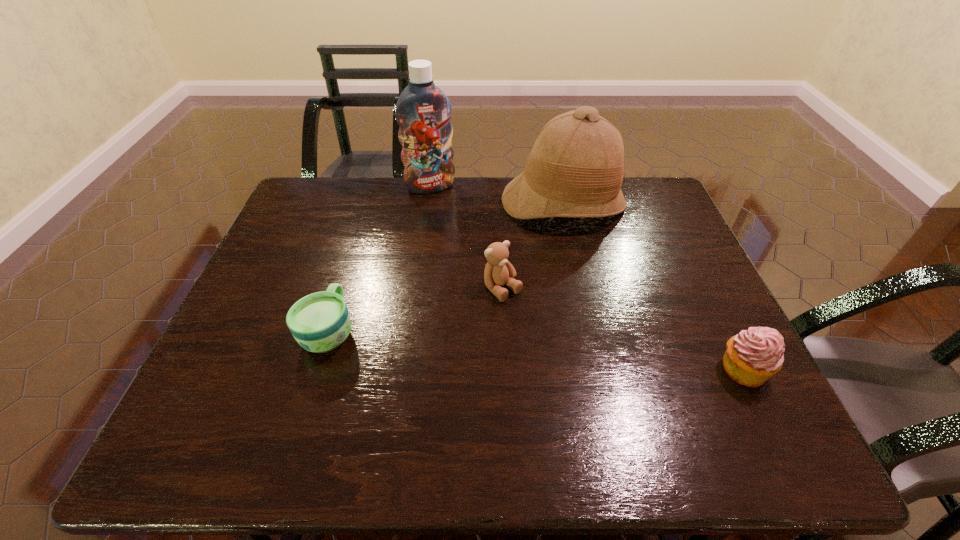
Where is `vacant space situated 0.100m on the front-facing side of the teddy bear`? The width and height of the screenshot is (960, 540). vacant space situated 0.100m on the front-facing side of the teddy bear is located at coordinates (540, 327).

This screenshot has height=540, width=960. I want to click on vacant space positioned on the front-facing side of the teddy bear, so click(x=563, y=350).

The image size is (960, 540). In order to click on blank area located on the front-facing side of the hat in this screenshot , I will do `click(580, 328)`.

The height and width of the screenshot is (540, 960). What are the coordinates of `vacant region located 0.310m on the front-facing side of the hat` in the screenshot? It's located at (578, 315).

At what (x,y) coordinates should I click in order to perform the action: click on vacant space located 0.310m on the front-facing side of the hat. Please return your answer as a coordinate pair (x, y). This screenshot has width=960, height=540. Looking at the image, I should click on (578, 315).

This screenshot has width=960, height=540. I want to click on vacant space located on the front label of the tallest object, so click(468, 262).

Where is `vacant space located 0.250m on the front label of the tallest object`? This screenshot has width=960, height=540. vacant space located 0.250m on the front label of the tallest object is located at coordinates (459, 242).

Find the location of a particular element. This screenshot has width=960, height=540. free space located 0.290m on the front label of the tallest object is located at coordinates (463, 251).

The image size is (960, 540). In order to click on hat positioned at the far edge in this screenshot , I will do `click(575, 169)`.

At what (x,y) coordinates should I click in order to perform the action: click on shampoo located in the far edge section of the desktop. Please return your answer as a coordinate pair (x, y). The image size is (960, 540). Looking at the image, I should click on (423, 111).